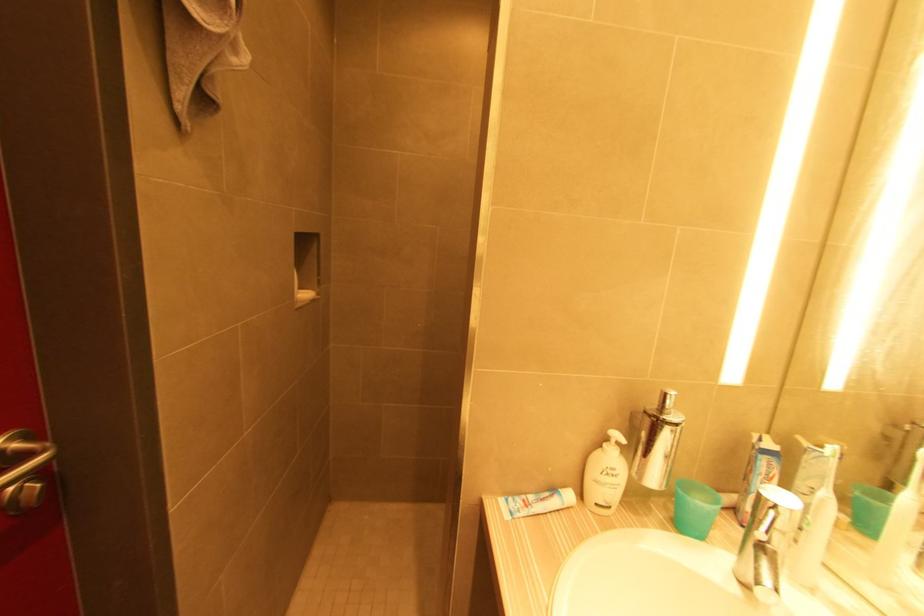
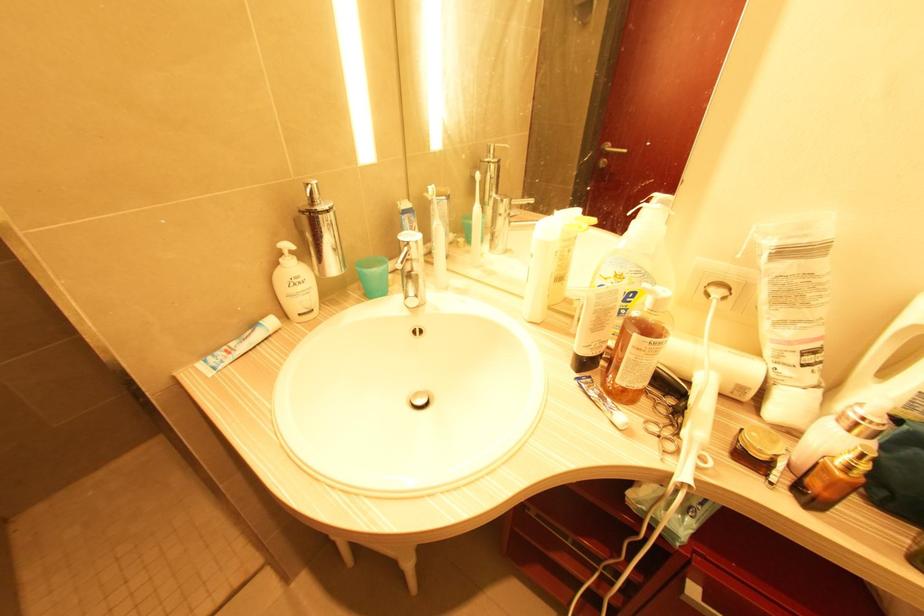
In the second image, find the point that corresponds to (772,513) in the first image.

(407, 249)